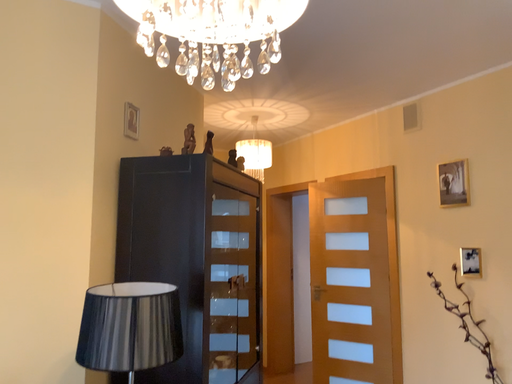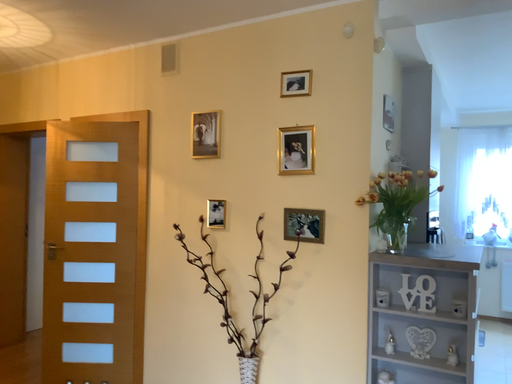
Question: How did the camera likely rotate when shooting the video?

Choices:
 (A) rotated upward
 (B) rotated downward

Answer: (B)